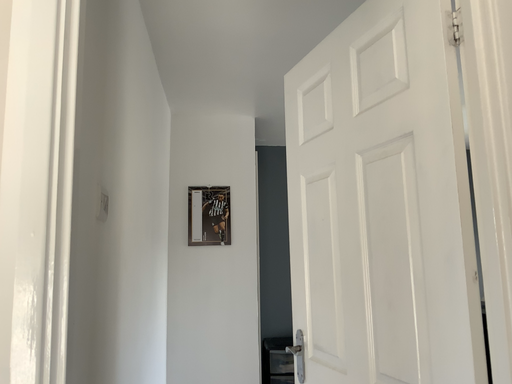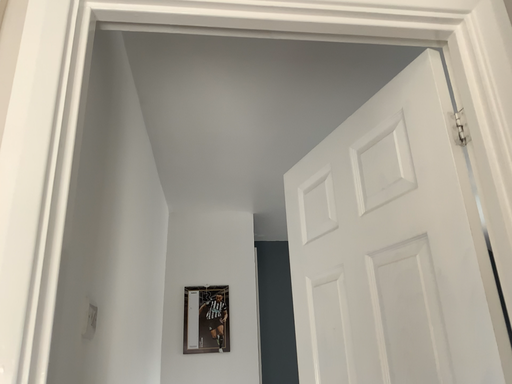
Question: How did the camera likely rotate when shooting the video?

Choices:
 (A) rotated downward
 (B) rotated upward

Answer: (B)